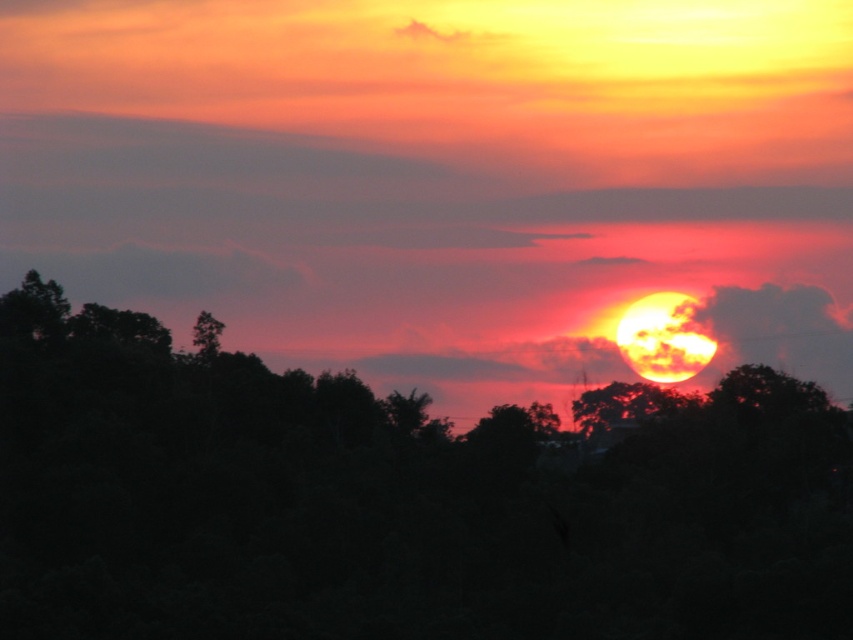
You are an artist trying to paint the sunset scene. You want to ensure the silhouette tree at center and the green leafy tree at upper left are proportionally accurate. Which tree should you paint larger in your artwork?

The silhouette tree at center should be painted larger than the green leafy tree at upper left because it has a larger size compared to the green leafy tree at upper left according to the description.

You are standing in the sunset scene and want to take a photo of the silhouette tree at center. Where exactly should you aim your camera to capture it perfectly?

You should aim your camera at point coordinates of (x=399, y=500) to capture the silhouette tree at center perfectly.